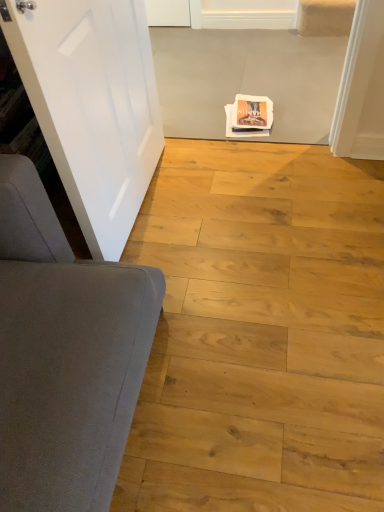
What do you see at coordinates (92, 105) in the screenshot? I see `white matte door at left` at bounding box center [92, 105].

The width and height of the screenshot is (384, 512). In order to click on white matte door at left in this screenshot , I will do `click(92, 105)`.

Find the location of a particular element. The image size is (384, 512). natural wood floor at center is located at coordinates (260, 332).

Describe the element at coordinates (260, 332) in the screenshot. I see `natural wood floor at center` at that location.

You are a GUI agent. You are given a task and a screenshot of the screen. Output one action in this format:
    pyautogui.click(x=<x>, y=<y>)
    Task: Click on the white matte door at left
    
    Given the screenshot: What is the action you would take?
    pyautogui.click(x=92, y=105)

Based on the photo, visually, is white matte door at left positioned to the left or to the right of natural wood floor at center?

Clearly, white matte door at left is on the left of natural wood floor at center in the image.

Considering the positions of objects white matte door at left and natural wood floor at center in the image provided, who is in front, white matte door at left or natural wood floor at center?

white matte door at left.

Which point is more forward, (66, 104) or (266, 185)?

The point (66, 104) is closer.

From the image's perspective, which is above, white matte door at left or natural wood floor at center?

From the image's view, white matte door at left is above.

From a real-world perspective, between white matte door at left and natural wood floor at center, who is vertically higher?

white matte door at left.

Which of these two, white matte door at left or natural wood floor at center, is thinner?

Thinner between the two is white matte door at left.

From the picture: Between white matte door at left and natural wood floor at center, which one has less height?

natural wood floor at center is shorter.

Considering the sizes of white matte door at left and natural wood floor at center in the image, is white matte door at left bigger or smaller than natural wood floor at center?

white matte door at left is smaller than natural wood floor at center.

Choose the correct answer: Is white matte door at left inside natural wood floor at center or outside it?

white matte door at left exists outside the volume of natural wood floor at center.

Are white matte door at left and natural wood floor at center beside each other?

white matte door at left and natural wood floor at center are clearly separated.

Is white matte door at left turned away from natural wood floor at center?

white matte door at left is not turned away from natural wood floor at center.

Identify the location of door above the natural wood floor at center (from a real-world perspective). This screenshot has width=384, height=512. (92, 105).

Is natural wood floor at center to the left or to the right of white matte door at left in the image?

Based on their positions, natural wood floor at center is located to the right of white matte door at left.

Who is more distant, natural wood floor at center or white matte door at left?

natural wood floor at center is more distant.

Is point (307, 204) farther from camera compared to point (88, 140)?

Yes, it is.

From the image's perspective, would you say natural wood floor at center is positioned over white matte door at left?

No.

From a real-world perspective, between natural wood floor at center and white matte door at left, who is vertically lower?

From a 3D spatial view, natural wood floor at center is below.

Between natural wood floor at center and white matte door at left, which one has larger width?

With larger width is natural wood floor at center.

Considering the sizes of natural wood floor at center and white matte door at left in the image, is natural wood floor at center taller or shorter than white matte door at left?

Considering their sizes, natural wood floor at center has less height than white matte door at left.

Consider the image. Does natural wood floor at center have a larger size compared to white matte door at left?

Correct, natural wood floor at center is larger in size than white matte door at left.

Is white matte door at left surrounded by natural wood floor at center?

Actually, white matte door at left is outside natural wood floor at center.

Are natural wood floor at center and white matte door at left beside each other?

No, natural wood floor at center is not next to white matte door at left.

Is natural wood floor at center oriented towards white matte door at left?

No, natural wood floor at center is not oriented towards white matte door at left.

Identify the location of plank lying behind the white matte door at left. This screenshot has height=512, width=384. (260, 332).

This screenshot has height=512, width=384. Identify the location of plank behind the white matte door at left. (260, 332).

In order to click on door on the left of natural wood floor at center in this screenshot , I will do `click(92, 105)`.